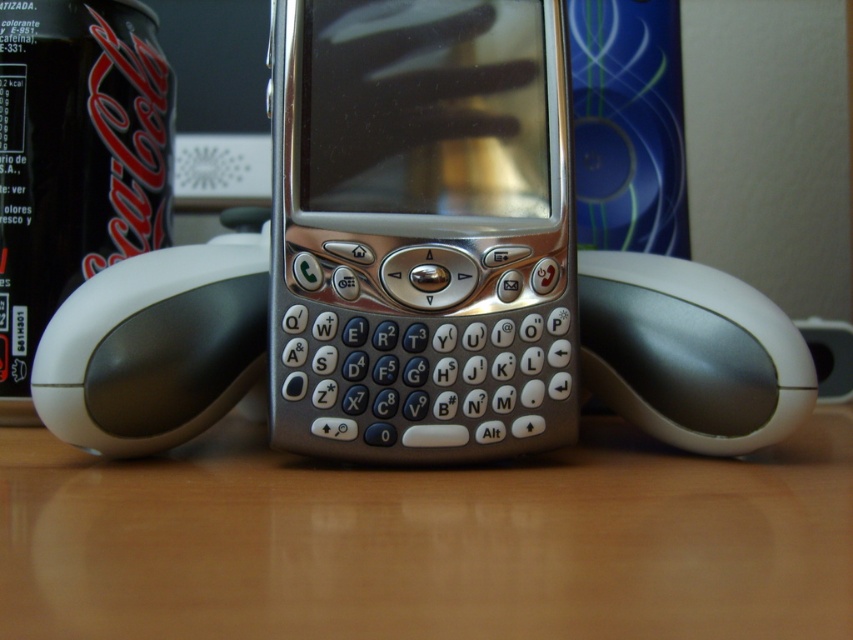
You are a graphic designer working on a project and need to place a new object exactly at the point marked as point (x=421, y=230). What object is already located there?

The silver metallic smartphone at center is located at point (x=421, y=230).

You have a robotic arm that needs to pick up the silver metallic smartphone at center and the white glossy mouse at center. The robotic arm can only reach objects within 6 inches. Can it pick up both items without moving its base?

The distance between the silver metallic smartphone at center and the white glossy mouse at center is 5.71 inches, which is within the robotic arm reach of 6 inches. Therefore, the robotic arm can pick up both items without moving its base.